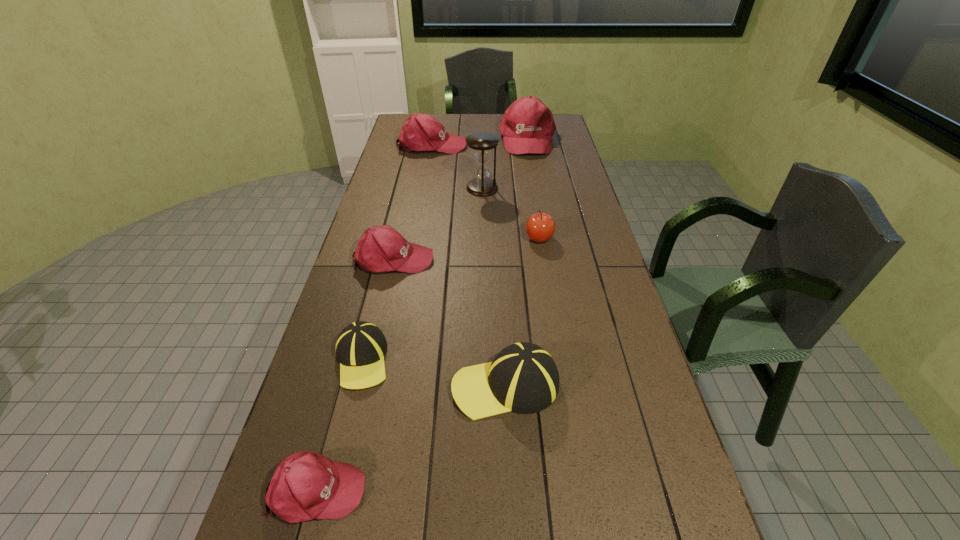
Where is `vacant space located 0.330m at the front of the smallest red baseball cap with the brim`? This screenshot has width=960, height=540. vacant space located 0.330m at the front of the smallest red baseball cap with the brim is located at coordinates (528, 490).

This screenshot has width=960, height=540. I want to click on free region located 0.170m with the brim of the left black baseball cap facing forward, so click(x=337, y=462).

The height and width of the screenshot is (540, 960). In order to click on object that is at the far edge in this screenshot , I will do `click(527, 126)`.

Locate an element on the screen. object that is positioned at the right edge is located at coordinates (527, 126).

Find the location of a particular element. The image size is (960, 540). object that is positioned at the far right corner is located at coordinates (527, 126).

Locate an element on the screen. This screenshot has height=540, width=960. free region at the left edge of the desktop is located at coordinates (387, 287).

Locate an element on the screen. The image size is (960, 540). vacant space at the right edge is located at coordinates (588, 193).

Image resolution: width=960 pixels, height=540 pixels. I want to click on free spot at the far left corner of the desktop, so click(x=405, y=119).

Locate an element on the screen. free space between the nearest red baseball cap and the smaller black baseball cap is located at coordinates (340, 425).

The image size is (960, 540). In order to click on vacant area between the tallest baseball cap and the hourglass in this screenshot , I will do `click(505, 164)`.